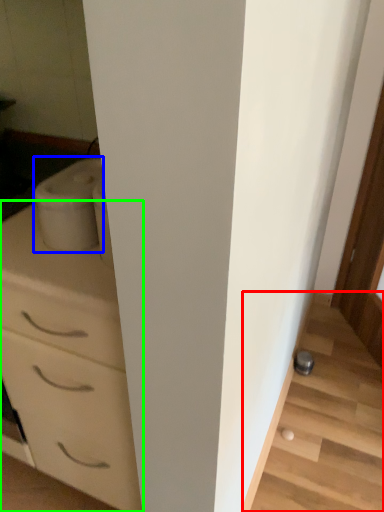
Question: Which object is the closest to the stairwell (highlighted by a red box)? Choose among these: appliance (highlighted by a blue box) or chest of drawers (highlighted by a green box).

Choices:
 (A) appliance
 (B) chest of drawers

Answer: (B)